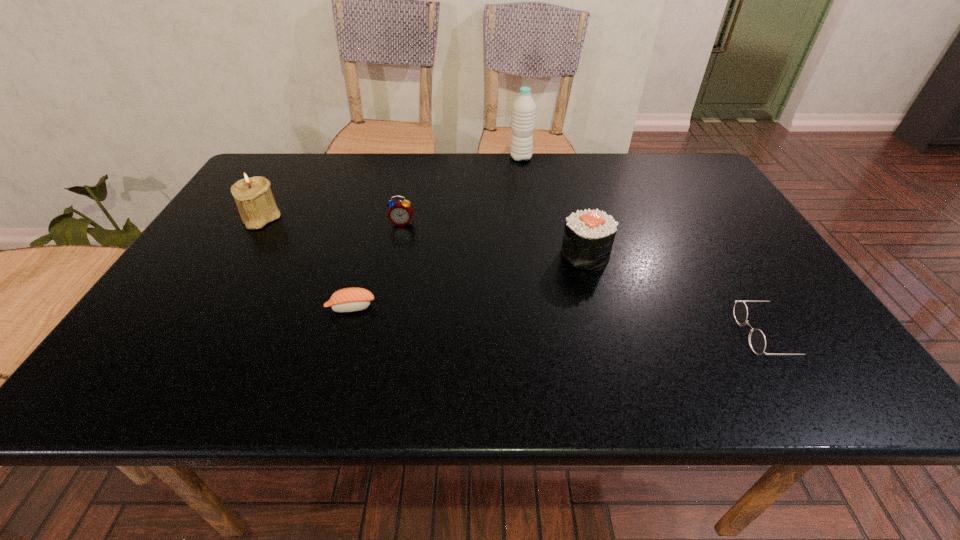
Image resolution: width=960 pixels, height=540 pixels. In order to click on free region that satisfies the following two spatial constraints: 1. on the back side of the right sushi; 2. on the left side of the nearer sushi in this screenshot , I will do `click(366, 255)`.

I want to click on free spot that satisfies the following two spatial constraints: 1. on the front-facing side of the alarm clock; 2. on the left side of the third nearest object, so click(395, 255).